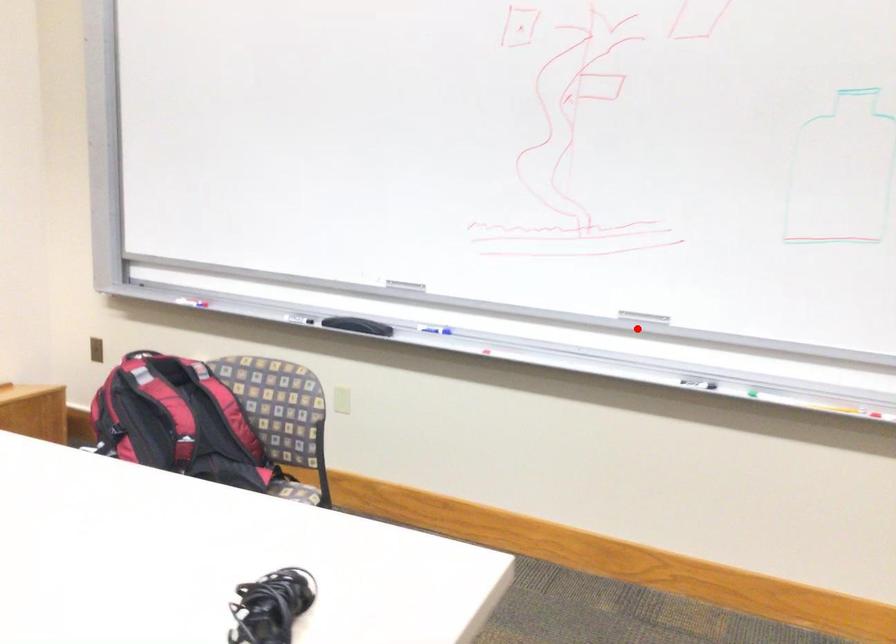
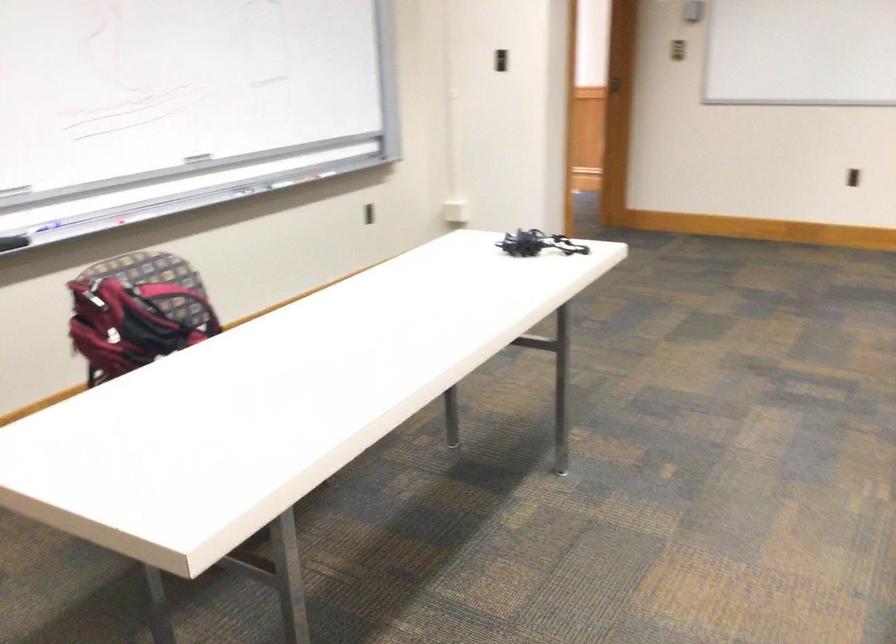
Question: I am providing you with two images of the same scene from different viewpoints. In image1, a red point is highlighted. Considering the same 3D point in image2, which of the following is correct?

Choices:
 (A) It is closer
 (B) It is farther

Answer: (B)